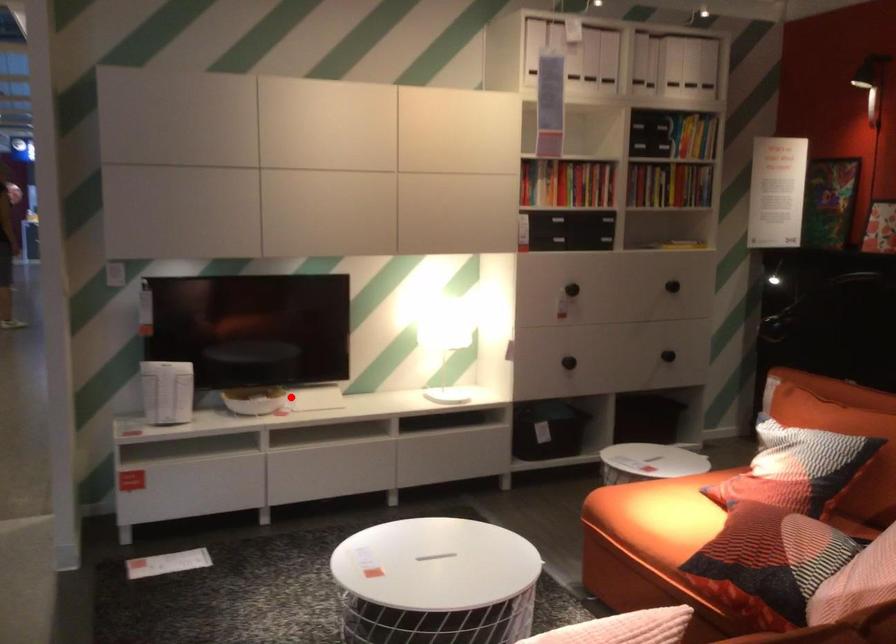
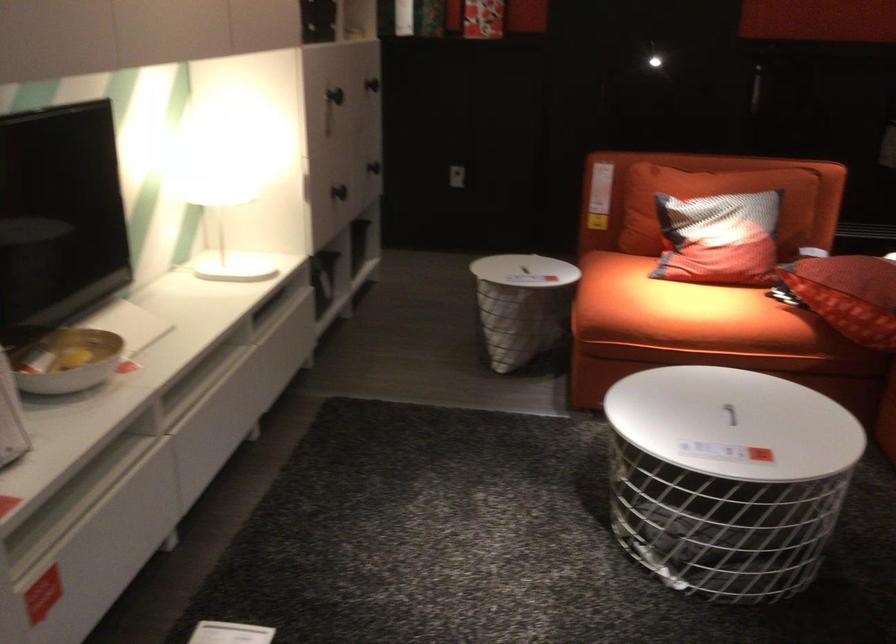
Question: I am providing you with two images of the same scene from different viewpoints. A red point is shown in image1. For the corresponding object point in image2, is it positioned nearer or farther from the camera?

Choices:
 (A) Nearer
 (B) Farther

Answer: (A)